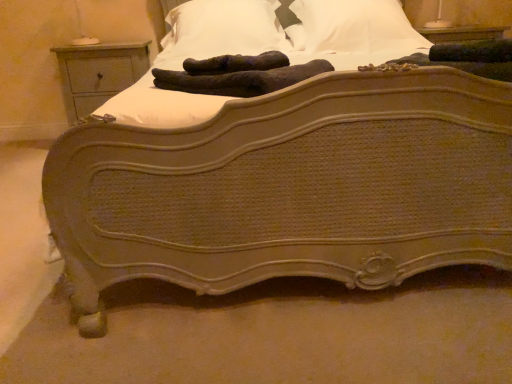
Question: Is brown fuzzy gloves at center in front of light gray wood nightstand at left?

Choices:
 (A) no
 (B) yes

Answer: (B)

Question: Does brown fuzzy gloves at center have a greater height compared to light gray wood nightstand at left?

Choices:
 (A) no
 (B) yes

Answer: (A)

Question: Does brown fuzzy gloves at center have a greater width compared to light gray wood nightstand at left?

Choices:
 (A) no
 (B) yes

Answer: (A)

Question: Does brown fuzzy gloves at center have a larger size compared to light gray wood nightstand at left?

Choices:
 (A) yes
 (B) no

Answer: (B)

Question: Does brown fuzzy gloves at center appear on the right side of light gray wood nightstand at left?

Choices:
 (A) yes
 (B) no

Answer: (A)

Question: Do you think white soft pillow at upper center, the first pillow positioned from the right, is within white soft pillow at upper center, which is the 2th pillow from right to left, or outside of it?

Choices:
 (A) outside
 (B) inside

Answer: (A)

Question: From a real-world perspective, is white soft pillow at upper center, the first pillow positioned from the right, positioned above or below white soft pillow at upper center, acting as the first pillow starting from the left?

Choices:
 (A) below
 (B) above

Answer: (A)

Question: From the image's perspective, is white soft pillow at upper center, which ranks as the second pillow in left-to-right order, above or below white soft pillow at upper center, which is the 2th pillow from right to left?

Choices:
 (A) below
 (B) above

Answer: (B)

Question: Is point (367, 46) closer or farther from the camera than point (248, 11)?

Choices:
 (A) closer
 (B) farther

Answer: (A)

Question: Does point (304, 36) appear closer or farther from the camera than point (230, 79)?

Choices:
 (A) farther
 (B) closer

Answer: (A)

Question: Considering their positions, is white soft pillow at upper center, which ranks as the second pillow in left-to-right order, located in front of or behind brown fuzzy gloves at center?

Choices:
 (A) behind
 (B) front

Answer: (A)

Question: Based on their positions, is white soft pillow at upper center, the first pillow positioned from the right, located to the left or right of brown fuzzy gloves at center?

Choices:
 (A) right
 (B) left

Answer: (A)

Question: From a real-world perspective, is white soft pillow at upper center, the first pillow positioned from the right, above or below brown fuzzy gloves at center?

Choices:
 (A) below
 (B) above

Answer: (B)

Question: Looking at the image, does light gray wood nightstand at left seem bigger or smaller compared to brown fuzzy gloves at center?

Choices:
 (A) small
 (B) big

Answer: (B)

Question: In the image, is light gray wood nightstand at left positioned in front of or behind brown fuzzy gloves at center?

Choices:
 (A) behind
 (B) front

Answer: (A)